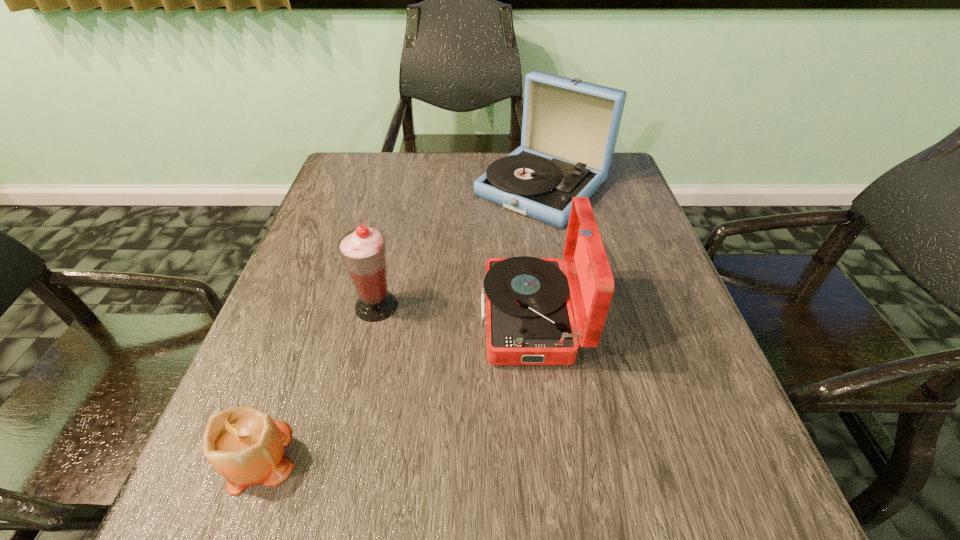
I want to click on vacant position located on the right of the leftmost object, so click(x=338, y=456).

In order to click on object that is at the far edge in this screenshot , I will do `click(569, 131)`.

Identify the location of object that is at the near edge. (244, 445).

Locate an element on the screen. smoothie that is at the left edge is located at coordinates (363, 251).

Find the location of a particular element. candle located in the left edge section of the desktop is located at coordinates (244, 445).

Locate an element on the screen. The width and height of the screenshot is (960, 540). object that is positioned at the right edge is located at coordinates (569, 131).

This screenshot has height=540, width=960. I want to click on object present at the near left corner, so click(x=244, y=445).

Locate an element on the screen. The height and width of the screenshot is (540, 960). object that is at the far right corner is located at coordinates [569, 131].

Find the location of `vacant space at the far edge of the desktop`. vacant space at the far edge of the desktop is located at coordinates (463, 165).

Locate an element on the screen. This screenshot has height=540, width=960. vacant space at the near edge is located at coordinates (462, 530).